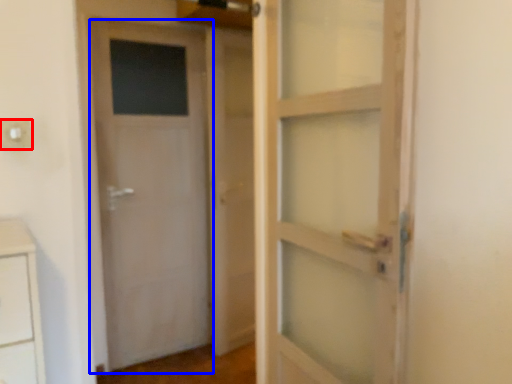
Question: Among these objects, which one is farthest to the camera, electric outlet (highlighted by a red box) or door (highlighted by a blue box)?

Choices:
 (A) electric outlet
 (B) door

Answer: (B)